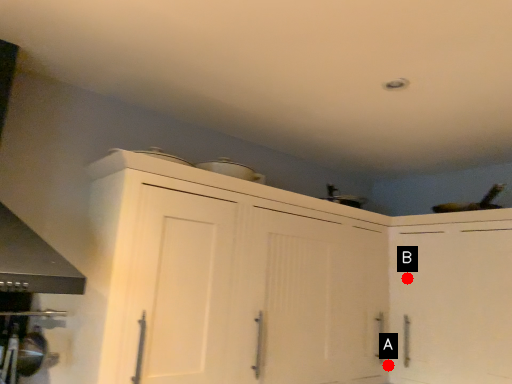
Question: Two points are circled on the image, labeled by A and B beside each circle. Which point appears closest to the camera in this image?

Choices:
 (A) A is closer
 (B) B is closer

Answer: (A)